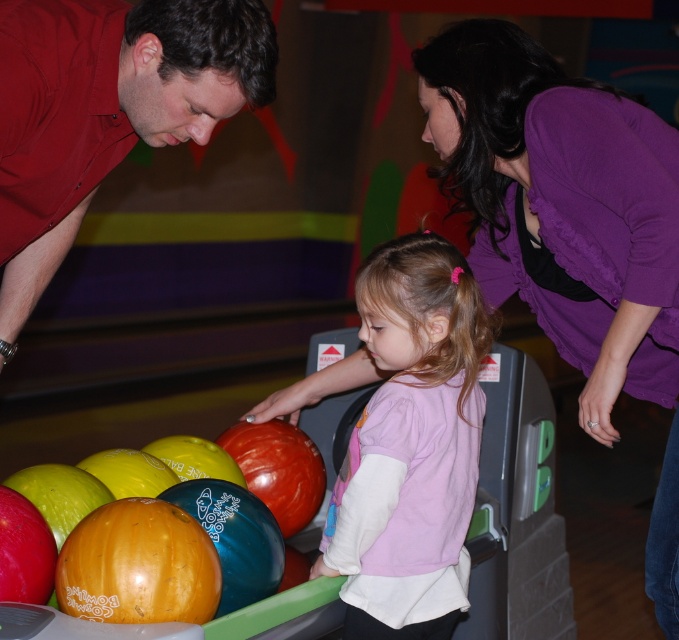
Can you confirm if purple fabric shirt at upper right is taller than pink fabric shirt at center?

Indeed, purple fabric shirt at upper right has a greater height compared to pink fabric shirt at center.

Does purple fabric shirt at upper right have a lesser width compared to pink fabric shirt at center?

In fact, purple fabric shirt at upper right might be wider than pink fabric shirt at center.

Who is more forward, [513,141] or [344,595]?

Point [344,595] is in front.

The height and width of the screenshot is (640, 679). Find the location of `purple fabric shirt at upper right`. purple fabric shirt at upper right is located at coordinates (562, 205).